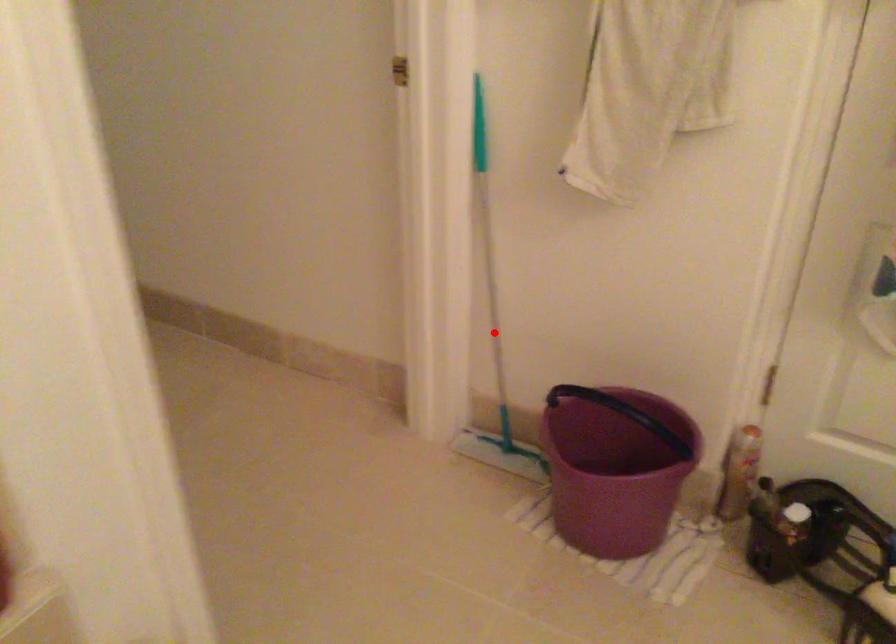
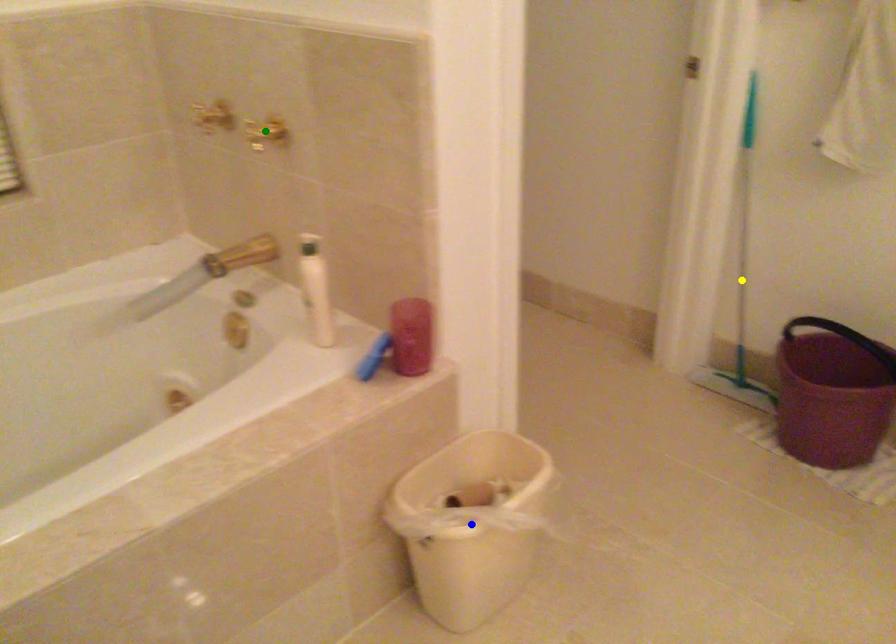
Question: I am providing you with two images of the same scene from different viewpoints. A red point is marked on the first image. You are given multiple points on the second image. Which point in image 2 represents the same 3d spot as the red point in image 1?

Choices:
 (A) blue point
 (B) green point
 (C) yellow point

Answer: (C)